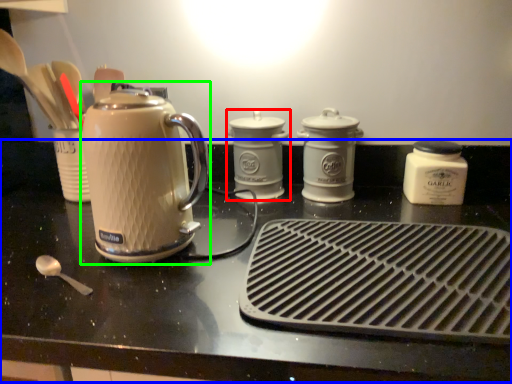
Question: Considering the real-world distances, which object is closest to kitchen appliance (highlighted by a red box)? table (highlighted by a blue box) or kettle (highlighted by a green box).

Choices:
 (A) table
 (B) kettle

Answer: (A)